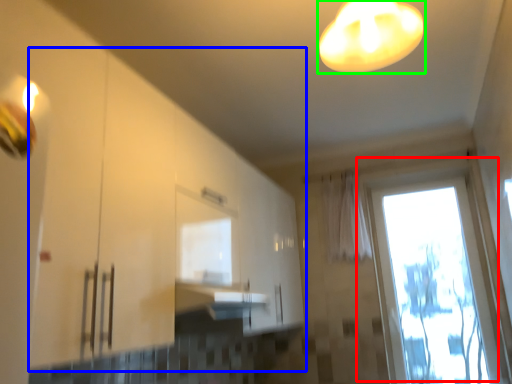
Question: Based on their relative distances, which object is farther from window (highlighted by a red box)? Choose from cabinetry (highlighted by a blue box) and lamp (highlighted by a green box).

Choices:
 (A) cabinetry
 (B) lamp

Answer: (B)